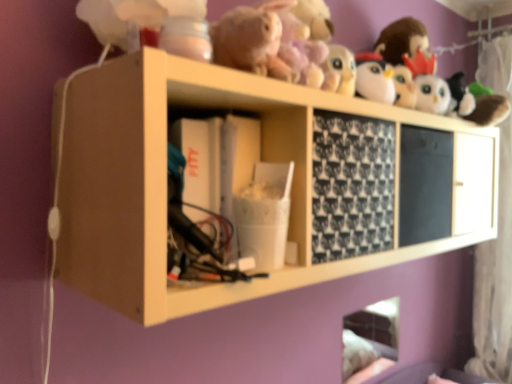
Question: Would you say white sheer curtain at right is part of wooden shelf at upper center's contents?

Choices:
 (A) yes
 (B) no

Answer: (B)

Question: Can you confirm if wooden shelf at upper center is taller than white sheer curtain at right?

Choices:
 (A) yes
 (B) no

Answer: (B)

Question: Considering the relative sizes of wooden shelf at upper center and white sheer curtain at right in the image provided, is wooden shelf at upper center smaller than white sheer curtain at right?

Choices:
 (A) yes
 (B) no

Answer: (B)

Question: Is wooden shelf at upper center in contact with white sheer curtain at right?

Choices:
 (A) yes
 (B) no

Answer: (B)

Question: Does wooden shelf at upper center have a lesser width compared to white sheer curtain at right?

Choices:
 (A) yes
 (B) no

Answer: (B)

Question: From the image's perspective, is wooden shelf at upper center located above white sheer curtain at right?

Choices:
 (A) yes
 (B) no

Answer: (A)

Question: Is white sheer curtain at right positioned with its back to wooden shelf at upper center?

Choices:
 (A) no
 (B) yes

Answer: (A)

Question: Is white sheer curtain at right thinner than wooden shelf at upper center?

Choices:
 (A) no
 (B) yes

Answer: (B)

Question: Considering the relative positions of white sheer curtain at right and wooden shelf at upper center in the image provided, is white sheer curtain at right in front of wooden shelf at upper center?

Choices:
 (A) yes
 (B) no

Answer: (B)

Question: Is wooden shelf at upper center a part of white sheer curtain at right?

Choices:
 (A) yes
 (B) no

Answer: (B)

Question: Does white sheer curtain at right come behind wooden shelf at upper center?

Choices:
 (A) yes
 (B) no

Answer: (A)

Question: Considering the relative sizes of white sheer curtain at right and wooden shelf at upper center in the image provided, is white sheer curtain at right taller than wooden shelf at upper center?

Choices:
 (A) yes
 (B) no

Answer: (A)

Question: Which is correct: white sheer curtain at right is inside wooden shelf at upper center, or outside of it?

Choices:
 (A) inside
 (B) outside

Answer: (B)